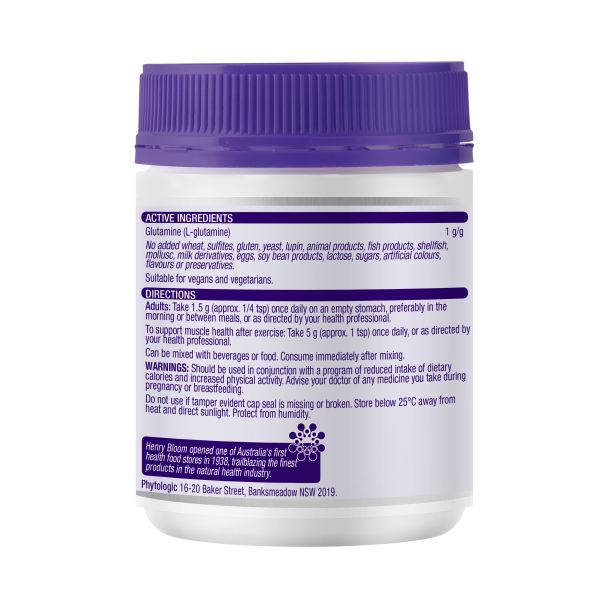
The height and width of the screenshot is (600, 600). I want to click on plastic container, so click(422, 460).